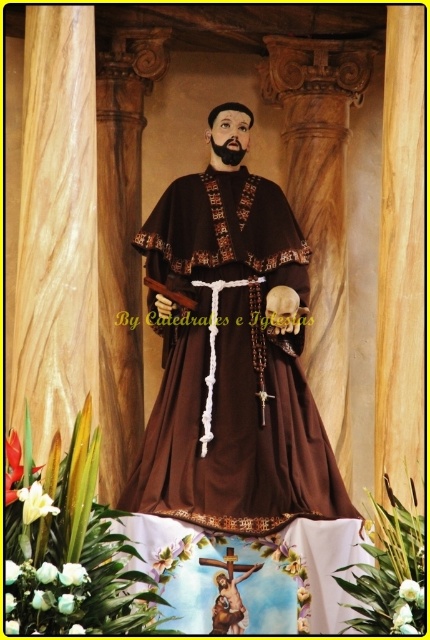
Which is in front, point (245, 205) or point (279, 294)?

Positioned in front is point (279, 294).

Which of these two, brown matte robe at center or brown wooden skull at center, stands taller?

brown matte robe at center

Does point (239, 220) come closer to viewer compared to point (272, 289)?

No, it is not.

Identify the location of brown matte robe at center. (230, 355).